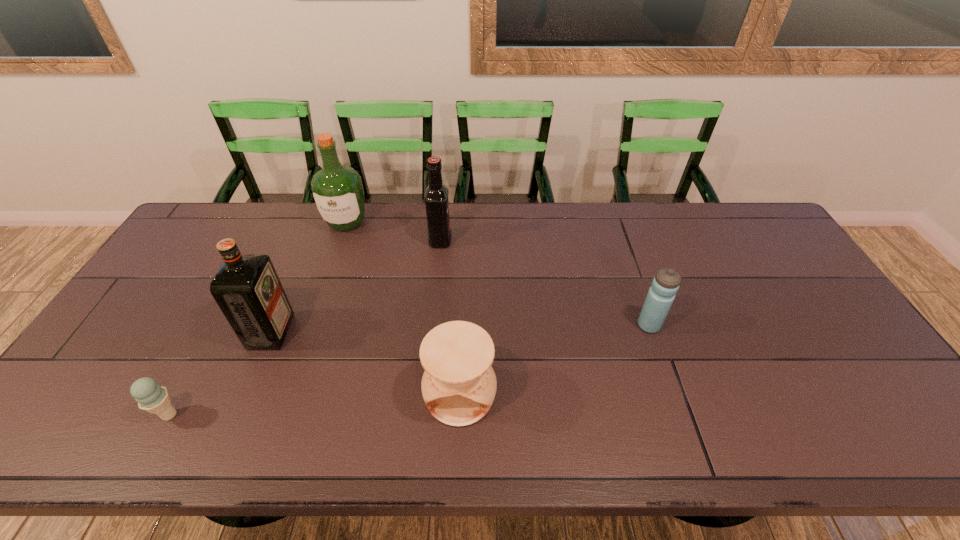
Find the location of a particular element. Image resolution: width=960 pixels, height=540 pixels. free space that is in between the rightmost object and the rightmost liquor is located at coordinates (544, 282).

At what (x,y) coordinates should I click in order to perform the action: click on vacant area that lies between the rightmost liquor and the water bottle. Please return your answer as a coordinate pair (x, y). This screenshot has height=540, width=960. Looking at the image, I should click on (544, 282).

Identify the location of vacant area between the rightmost liquor and the shortest object. (x=305, y=327).

Select which object appears as the second closest to the rightmost liquor. Please provide its 2D coordinates. Your answer should be formatted as a tuple, i.e. [(x, y)], where the tuple contains the x and y coordinates of a point satisfying the conditions above.

[(246, 287)]

You are a GUI agent. You are given a task and a screenshot of the screen. Output one action in this format:
    pyautogui.click(x=<x>, y=<y>)
    Task: Click on the object identified as the third closest to the ice cream
    This screenshot has height=540, width=960.
    Given the screenshot: What is the action you would take?
    pyautogui.click(x=337, y=190)

Locate an element on the screen. This screenshot has height=540, width=960. the second closest liquor to the rightmost liquor is located at coordinates (246, 287).

Where is `liquor that stands as the second closest to the nearest liquor`? liquor that stands as the second closest to the nearest liquor is located at coordinates (436, 194).

Find the location of `blank space that satisfies the following two spatial constraints: 1. on the front-facing side of the rightmost liquor; 2. on the right side of the water bottle`. blank space that satisfies the following two spatial constraints: 1. on the front-facing side of the rightmost liquor; 2. on the right side of the water bottle is located at coordinates (432, 325).

Identify the location of free location that satisfies the following two spatial constraints: 1. on the front side of the water bottle; 2. on the front label of the nearest liquor. The width and height of the screenshot is (960, 540). (651, 332).